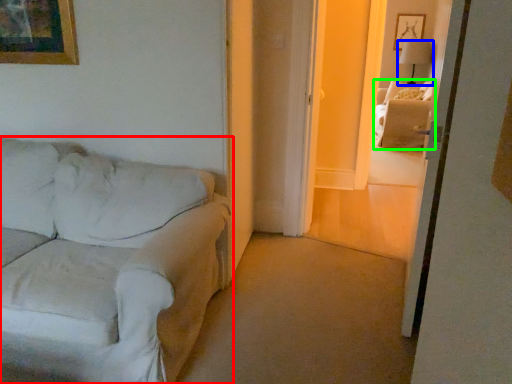
Question: Which is nearer to the studio couch (highlighted by a red box)? lamp (highlighted by a blue box) or couch (highlighted by a green box).

Choices:
 (A) lamp
 (B) couch

Answer: (B)